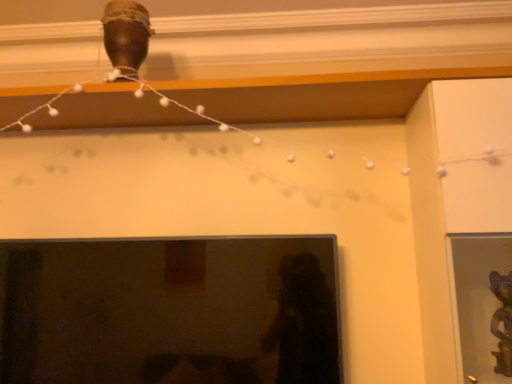
In order to face matte black picture frame at lower center, should I rotate leftwards or rightwards?

Rotate left and turn 12.193 degrees.

Find the location of a particular element. The image size is (512, 384). matte black picture frame at lower center is located at coordinates click(x=170, y=311).

This screenshot has width=512, height=384. What do you see at coordinates (170, 311) in the screenshot?
I see `matte black picture frame at lower center` at bounding box center [170, 311].

Locate an element on the screen. The width and height of the screenshot is (512, 384). matte black picture frame at lower center is located at coordinates (170, 311).